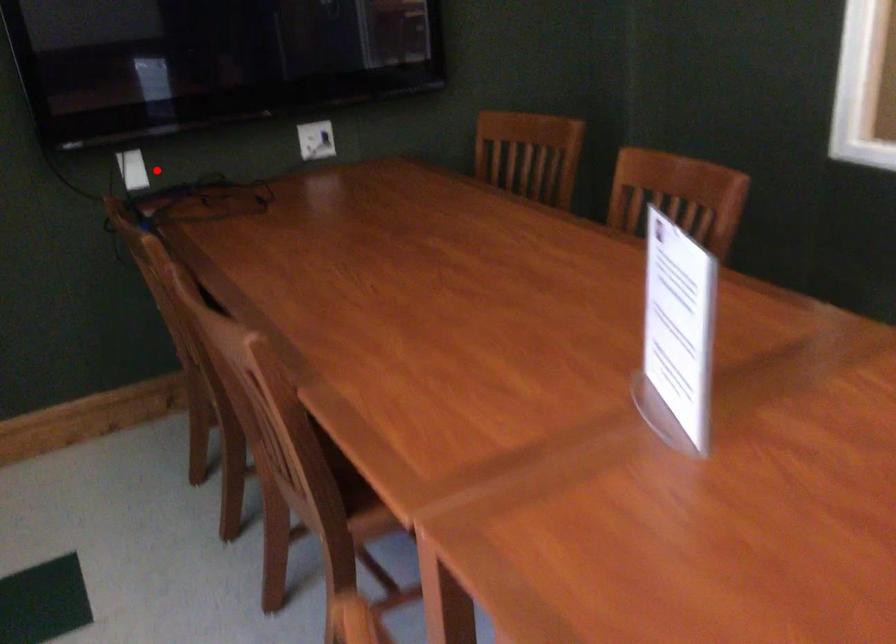
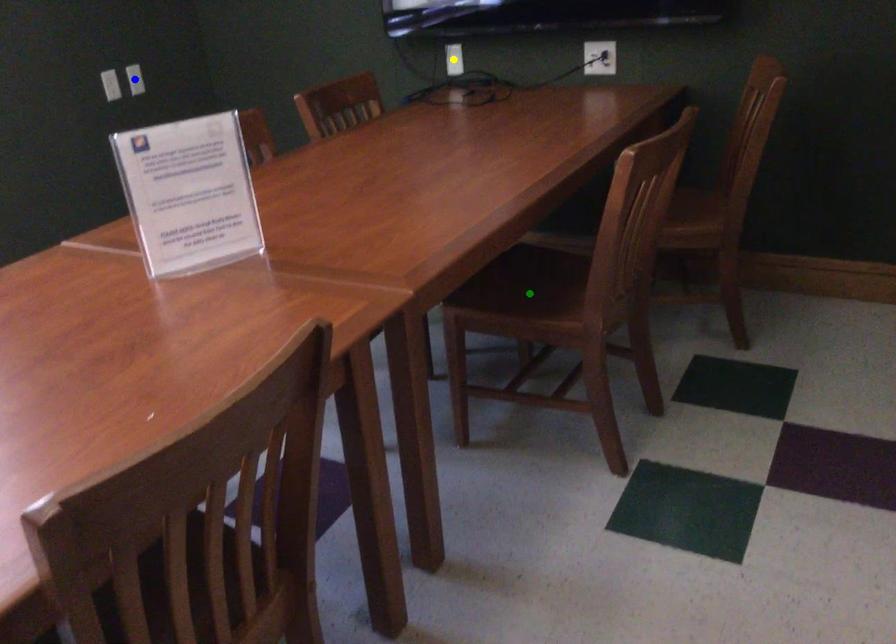
Question: I am providing you with two images of the same scene from different viewpoints. A red point is marked on the first image. You are given multiple points on the second image. In image 2, which mark is for the same physical point as the one in image 1?

Choices:
 (A) green point
 (B) yellow point
 (C) blue point

Answer: (B)